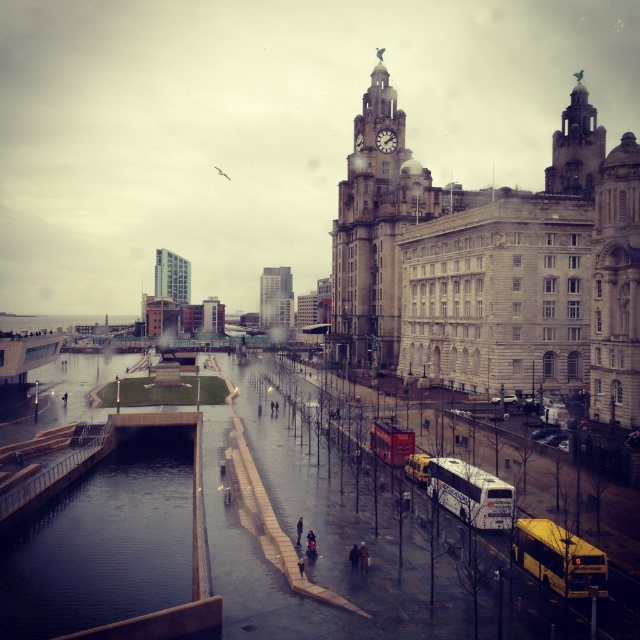
You are standing at the point closer to the camera in this rainy urban scene. Which point are you at, point (580, 156) or point (483, 516)?

You are at point (580, 156) because it is further to the camera than point (483, 516).